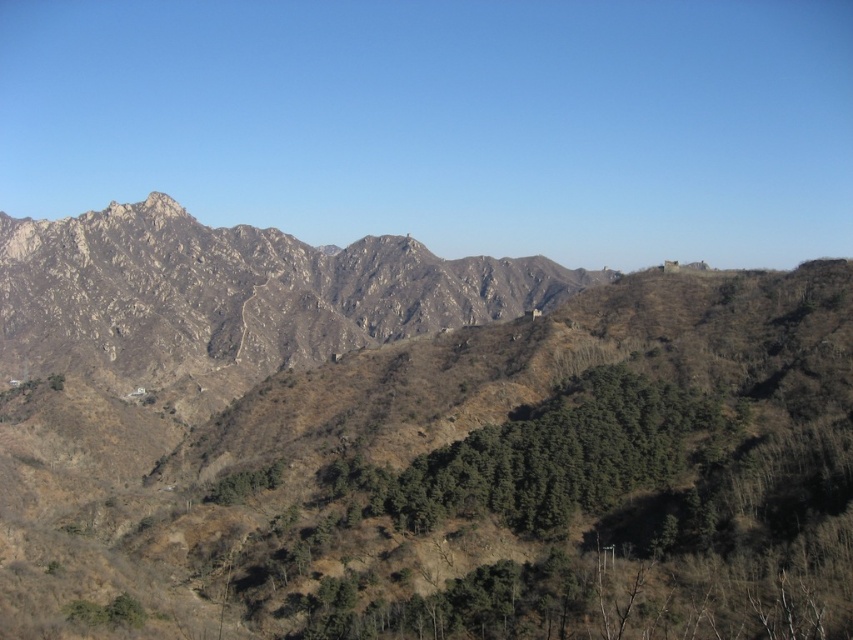
You are a hiker planning to climb the mountains in this scene. You have two options for your route. One path leads to the brown rocky mountain at center, and the other to the rocky brown mountain range at center. Which mountain will require a longer climb due to its height?

The brown rocky mountain at center is taller than the rocky brown mountain range at center, so the path to the brown rocky mountain at center will require a longer climb due to its greater height.

You are a hiker standing at the base of the brown rocky mountain at center and want to reach the rocky brown mountain range at center. Which mountain will you have to climb first?

You will have to climb the brown rocky mountain at center first because it is closer to you than the rocky brown mountain range at center, which is further away.

You are a hiker planning to take a photo of the brown rocky mountain at center and the rocky brown mountain range at center. Which one should you focus on if you want to capture the larger landscape feature in your shot?

The brown rocky mountain at center is bigger than the rocky brown mountain range at center, so you should focus on the brown rocky mountain at center to capture the larger landscape feature.